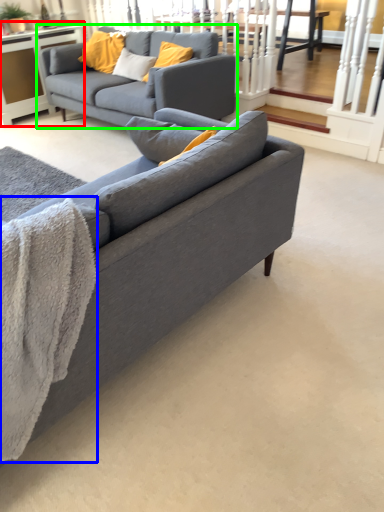
Question: Estimate the real-world distances between objects in this image. Which object is closer to table (highlighted by a red box), blanket (highlighted by a blue box) or studio couch (highlighted by a green box)?

Choices:
 (A) blanket
 (B) studio couch

Answer: (B)